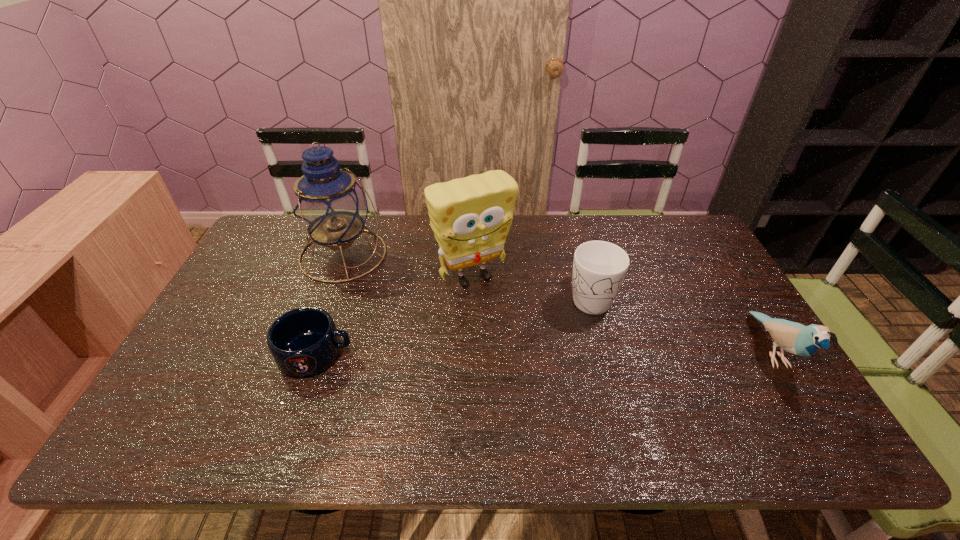
Identify the location of the left mug. This screenshot has height=540, width=960. click(x=305, y=341).

Where is `the shorter mug`? This screenshot has width=960, height=540. the shorter mug is located at coordinates (305, 341).

You are a GUI agent. You are given a task and a screenshot of the screen. Output one action in this format:
    pyautogui.click(x=<x>, y=<y>)
    Task: Click on the bird
    Image resolution: width=960 pixels, height=540 pixels.
    Given the screenshot: What is the action you would take?
    pyautogui.click(x=795, y=338)

Where is `lantern`? lantern is located at coordinates click(329, 204).

Image resolution: width=960 pixels, height=540 pixels. I want to click on sponge, so click(471, 217).

Image resolution: width=960 pixels, height=540 pixels. Find the location of `the third object from right to left`. the third object from right to left is located at coordinates (471, 217).

This screenshot has height=540, width=960. Find the location of `the second object from right to left`. the second object from right to left is located at coordinates (599, 267).

This screenshot has height=540, width=960. Find the location of `the taller mug`. the taller mug is located at coordinates (x=599, y=267).

Where is `vacant point located 0.080m with the handle on the side of the left mug`? vacant point located 0.080m with the handle on the side of the left mug is located at coordinates (384, 353).

Identify the location of vacant area located on the front-facing side of the tallest object. (415, 302).